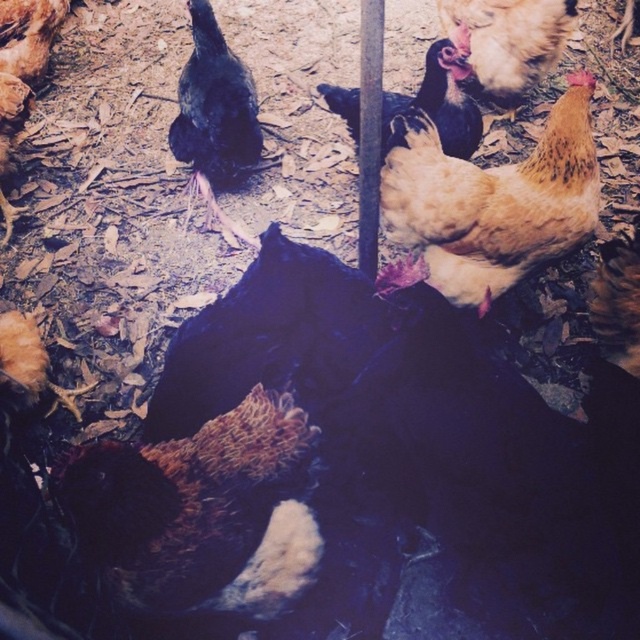
Question: Is brown speckled chicken at lower left positioned behind black matte chicken at upper left?

Choices:
 (A) yes
 (B) no

Answer: (B)

Question: Which object is the closest to the brown textured chicken at center?

Choices:
 (A) black matte chicken at upper left
 (B) golden feathered chicken at center
 (C) brown speckled chicken at upper right

Answer: (B)

Question: Can you confirm if brown speckled chicken at lower left is positioned to the left of black matte chicken at upper left?

Choices:
 (A) no
 (B) yes

Answer: (A)

Question: Which point is farther from the camera taking this photo?

Choices:
 (A) (93, 518)
 (B) (236, 58)

Answer: (B)

Question: Which of the following is the closest to the observer?

Choices:
 (A) (42, 374)
 (B) (465, 97)

Answer: (A)

Question: Can you confirm if brown speckled feathers at center is positioned below brown textured chicken at center?

Choices:
 (A) no
 (B) yes

Answer: (B)